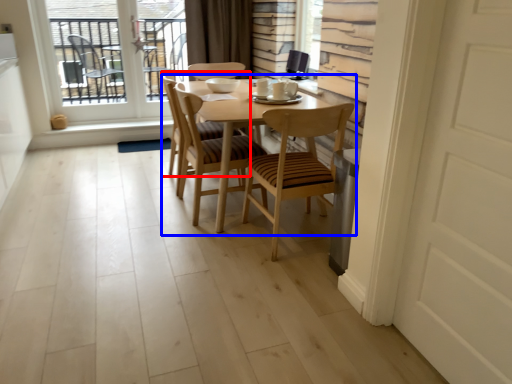
Question: Which of the following is the closest to the observer, chair (highlighted by a red box) or kitchen & dining room table (highlighted by a blue box)?

Choices:
 (A) chair
 (B) kitchen & dining room table

Answer: (B)